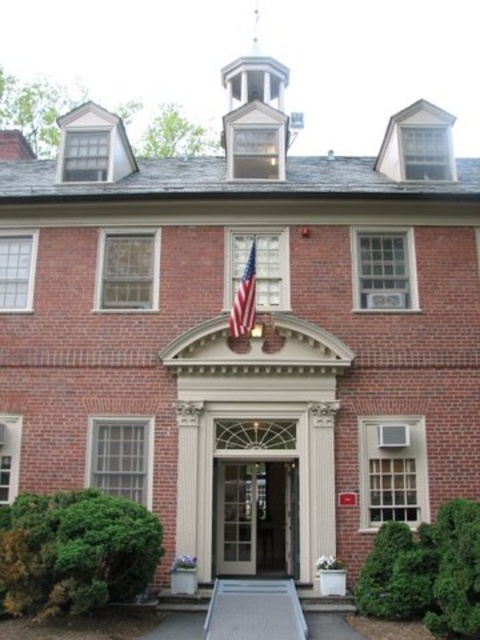
You are standing in front of the brick building and want to enter through the clear glass door at center. Based on the coordinates provided, can you confirm if the point at (255,516) is the correct location of the clear glass door at center?

Yes, the point at (255,516) corresponds to the clear glass door at center as stated in the objects description.

You are standing in front of the brick building and want to enter through the clear glass door at center. However, there is an american flag at center blocking your path. Can you walk through the door without moving the flag?

The clear glass door at center is closer to the viewer than the american flag at center, so the flag is actually behind the door. Therefore, you can walk through the clear glass door at center without moving the flag.

You are standing in front of the building and notice two points marked on its facade. The first point is at coordinate point (242, 547) and the second is at point (253, 317). Which point is farther away from you as you face the building?

Point (242, 547) is behind point (253, 317), so the point at (242, 547) is farther away from you as you face the building.